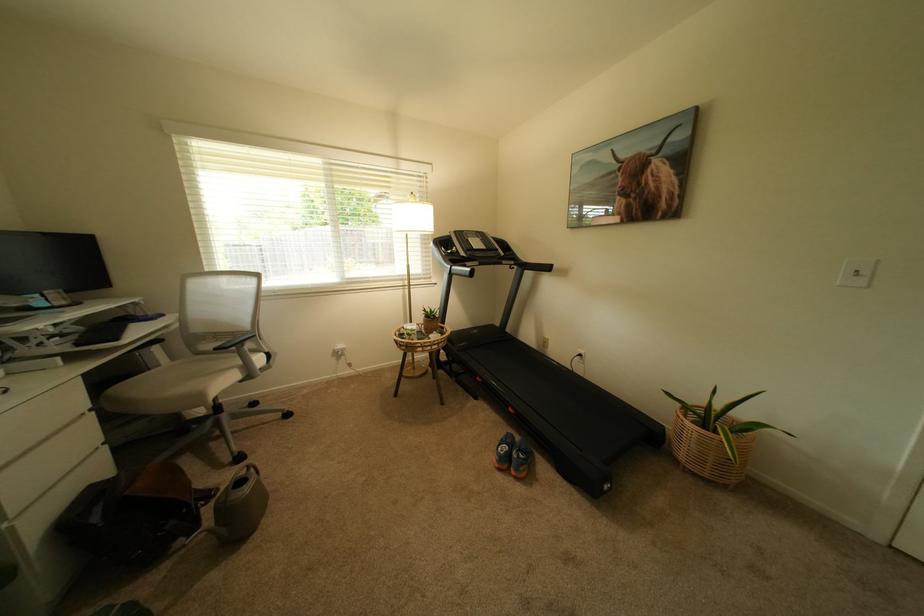
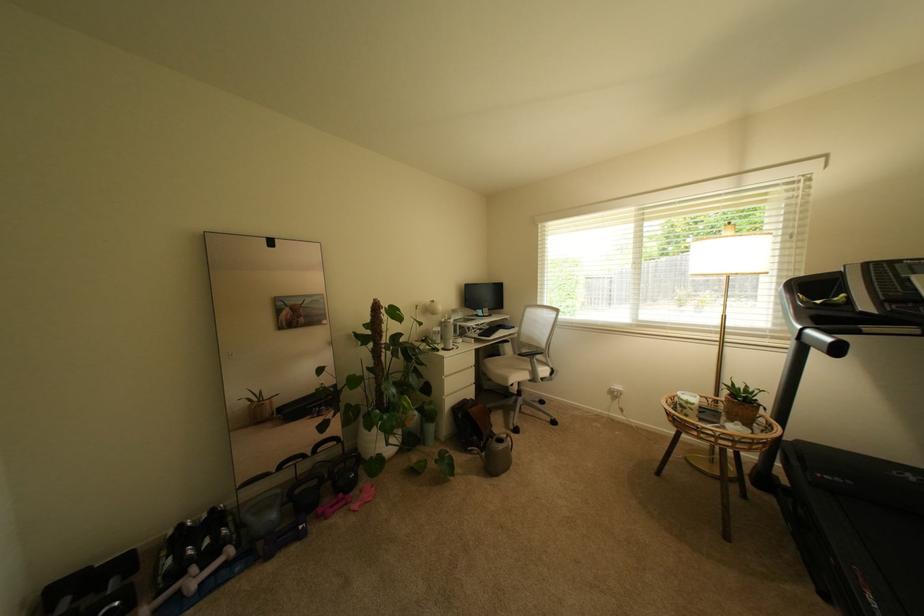
Where in the second image is the point corresponding to [204,491] from the first image?

(500, 432)